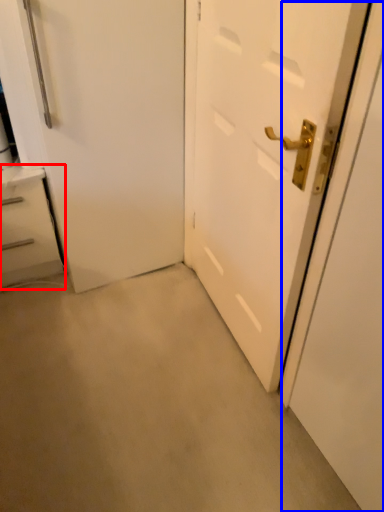
Question: Which of the following is the closest to the observer, chest of drawers (highlighted by a red box) or screen door (highlighted by a blue box)?

Choices:
 (A) chest of drawers
 (B) screen door

Answer: (B)